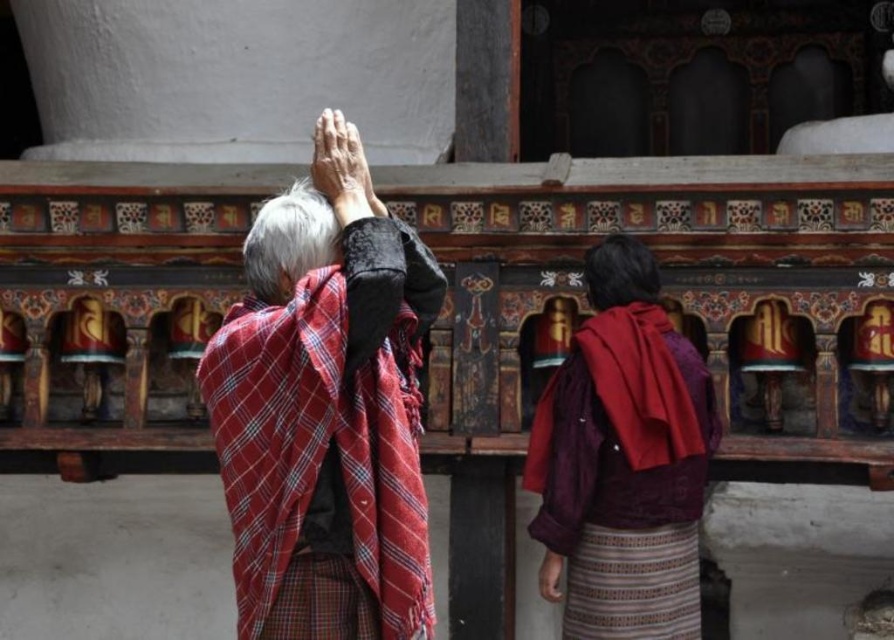
You are a photographer trying to capture the scene of the two individuals in the temple. You notice the red plaid shawl at center and the maroon textured shawl at center. Which shawl is visible on top?

The red plaid shawl at center is positioned over maroon textured shawl at center, so the red plaid shawl at center is visible on top.

You are a photographer trying to capture both the red plaid shawl at center and the maroon textured shawl at center in a single frame. Based on their lengths, which shawl should you focus on to ensure it is fully visible in the photo?

The red plaid shawl at center is shorter than the maroon textured shawl at center, so focusing on the maroon textured shawl at center ensures it will be fully visible in the photo.